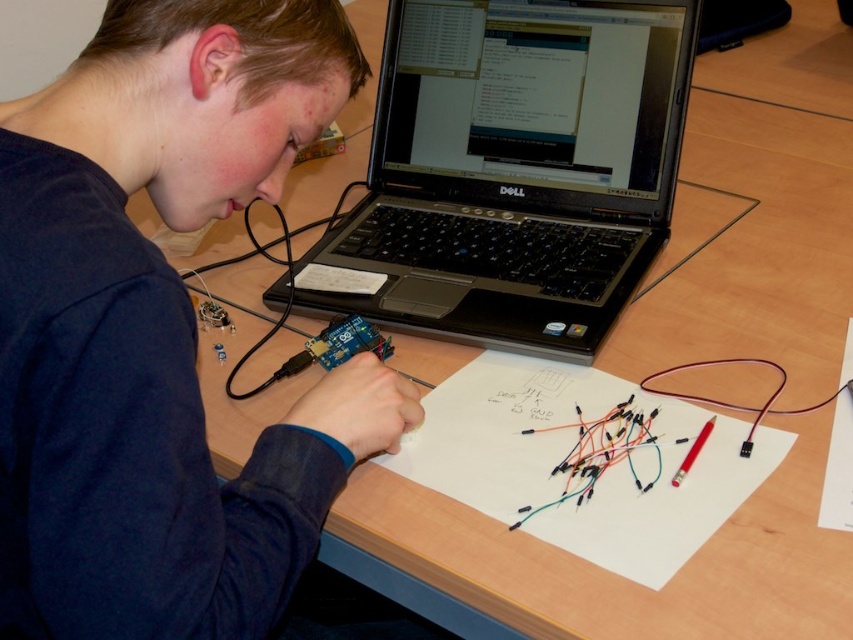
Question: Among these points, which one is nearest to the camera?

Choices:
 (A) (129, 125)
 (B) (610, 3)

Answer: (A)

Question: Which of the following is the farthest from the observer?

Choices:
 (A) dark blue fabric at upper left
 (B) black plastic laptop at center

Answer: (B)

Question: Which of the following is the farthest from the observer?

Choices:
 (A) (427, 202)
 (B) (206, 24)

Answer: (A)

Question: Can you confirm if dark blue fabric at upper left is wider than black plastic laptop at center?

Choices:
 (A) no
 (B) yes

Answer: (A)

Question: Where is dark blue fabric at upper left located in relation to black plastic laptop at center in the image?

Choices:
 (A) below
 (B) above

Answer: (A)

Question: Does dark blue fabric at upper left come behind black plastic laptop at center?

Choices:
 (A) yes
 (B) no

Answer: (B)